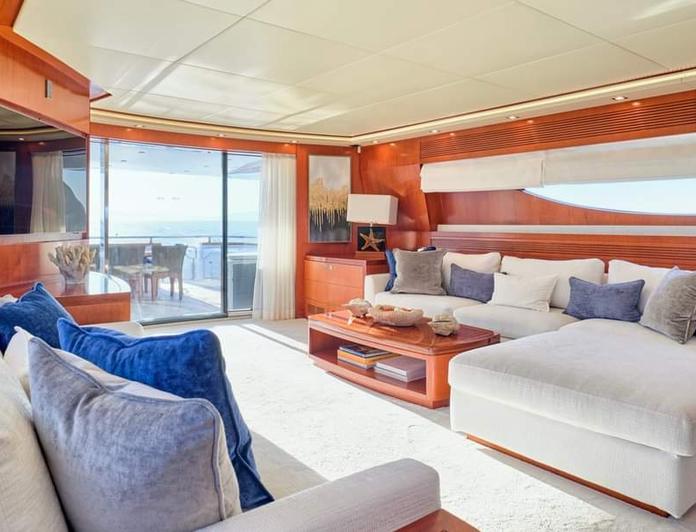
Where is `curtain`? The image size is (696, 532). curtain is located at coordinates (268, 222).